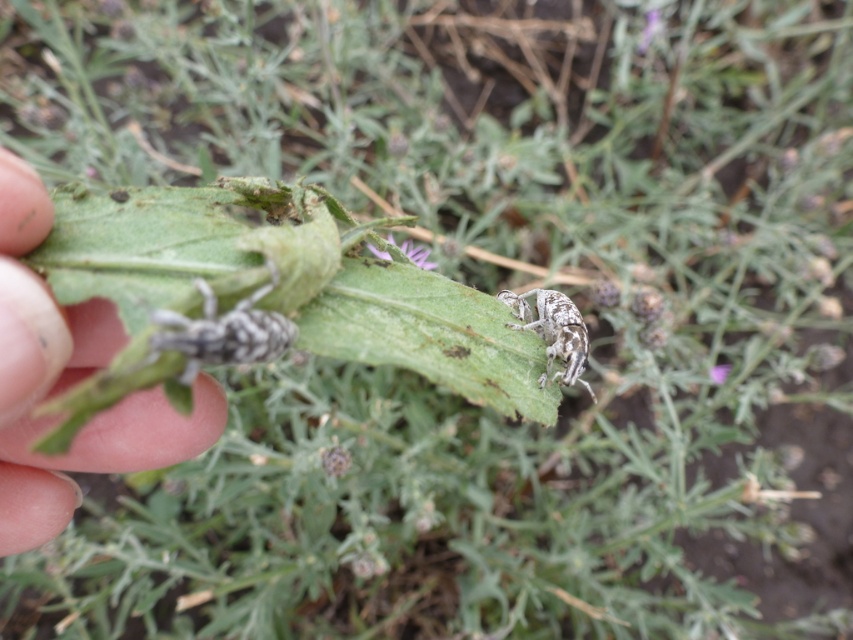
Which is above, gray matte insect at center or white matte insect at center?

gray matte insect at center

Can you confirm if gray matte insect at center is wider than white matte insect at center?

In fact, gray matte insect at center might be narrower than white matte insect at center.

Does point (254, 314) lie behind point (581, 349)?

No, it is in front of (581, 349).

Find the location of a particular element. gray matte insect at center is located at coordinates 223,332.

Can you confirm if gray matte insect at center is positioned to the right of purple matte flower at center?

→ In fact, gray matte insect at center is to the left of purple matte flower at center.

What do you see at coordinates (223, 332) in the screenshot? This screenshot has width=853, height=640. I see `gray matte insect at center` at bounding box center [223, 332].

Is point (260, 348) less distant than point (405, 244)?

Yes, point (260, 348) is in front of point (405, 244).

Locate an element on the screen. gray matte insect at center is located at coordinates coord(223,332).

Is white matte insect at center positioned in front of purple matte flower at center?

Yes, white matte insect at center is closer to the viewer.

Who is more distant from viewer, [543,291] or [425,257]?

The point [425,257] is more distant.

This screenshot has width=853, height=640. What do you see at coordinates (553, 332) in the screenshot?
I see `white matte insect at center` at bounding box center [553, 332].

Image resolution: width=853 pixels, height=640 pixels. Identify the location of white matte insect at center. (553, 332).